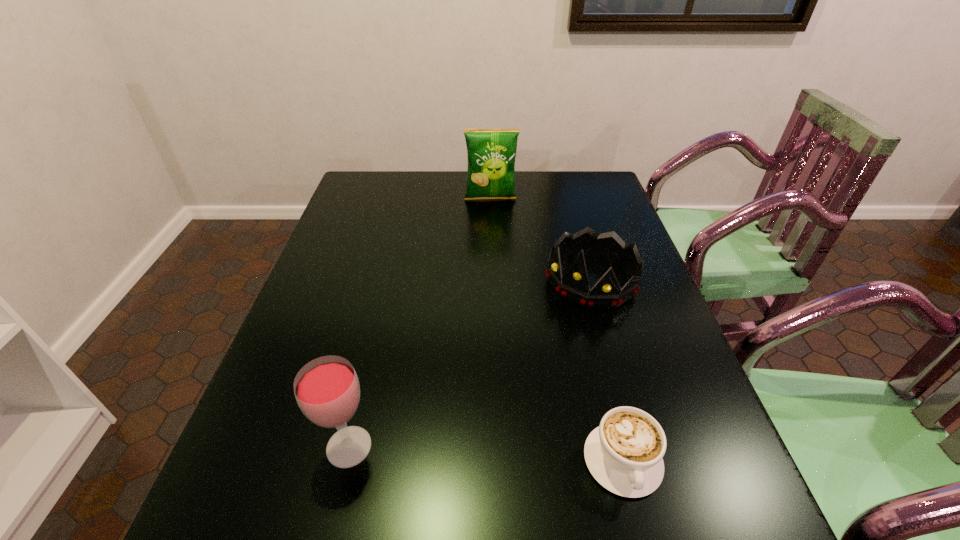
What are the coordinates of `wineglass` in the screenshot? It's located at (327, 390).

Identify the location of the second tallest object. (327, 390).

This screenshot has width=960, height=540. In order to click on the shortest object in this screenshot , I will do `click(624, 454)`.

Identify the location of the farthest object. This screenshot has height=540, width=960. [x=491, y=153].

Where is `the third object from right to left`? Image resolution: width=960 pixels, height=540 pixels. the third object from right to left is located at coordinates [491, 153].

Where is `the third nearest object`? This screenshot has width=960, height=540. the third nearest object is located at coordinates (575, 287).

Identify the location of tiara. Image resolution: width=960 pixels, height=540 pixels. (575, 287).

Where is `vacant space located on the right of the leftmost object`? vacant space located on the right of the leftmost object is located at coordinates (407, 447).

In order to click on vacant area situated on the front-facing side of the farthest object in this screenshot , I will do `click(494, 237)`.

This screenshot has width=960, height=540. Find the location of `vacant space situated on the front-facing side of the farthest object`. vacant space situated on the front-facing side of the farthest object is located at coordinates (496, 255).